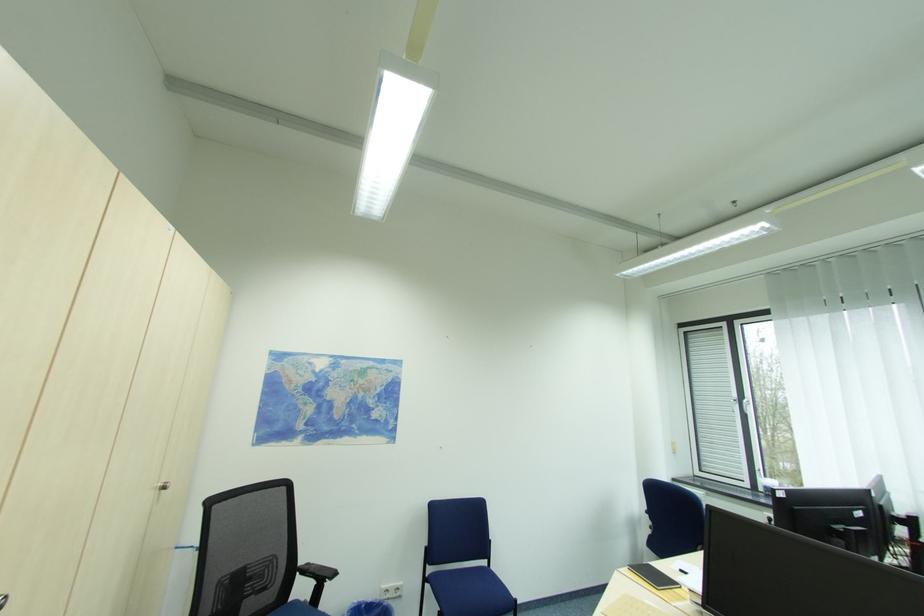
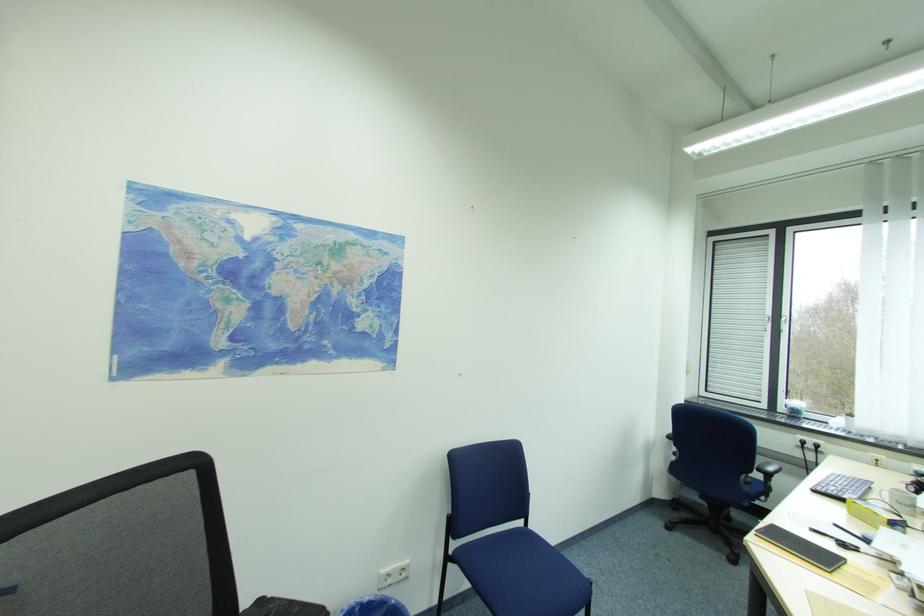
Which direction would the cameraman need to move to produce the second image?

The cameraman moved toward left, forward.